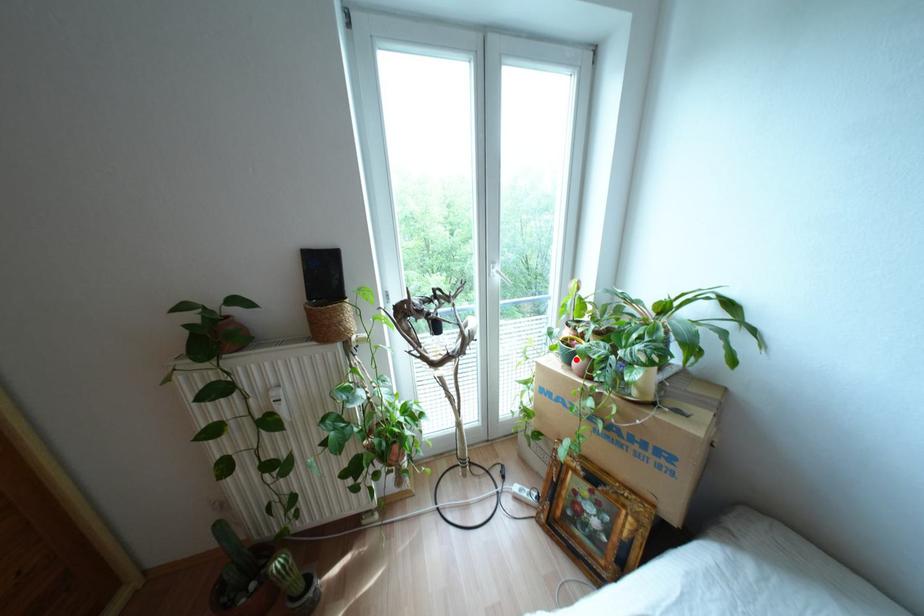
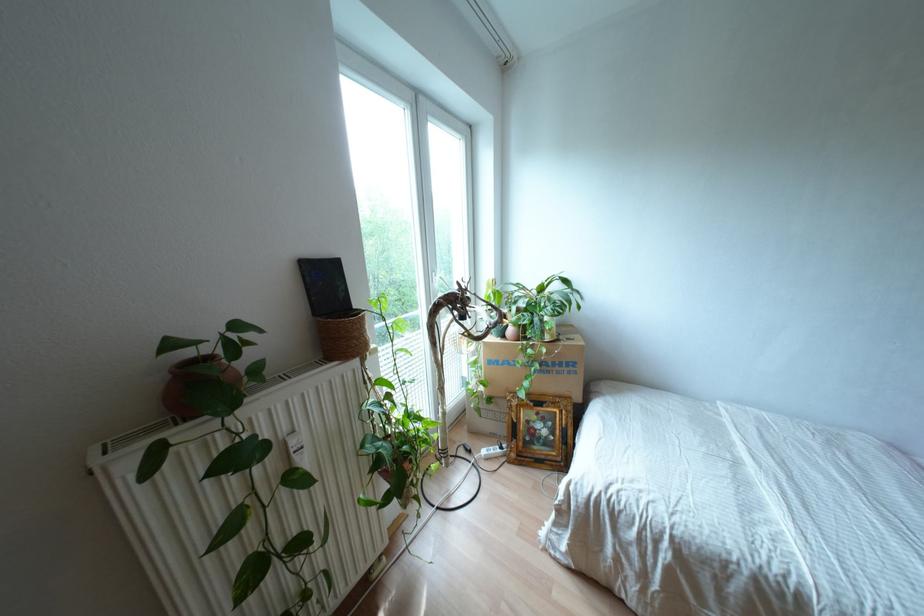
Question: I am providing you with two images of the same scene from different viewpoints. A red point is shown in image1. For the corresponding object point in image2, is it positioned nearer or farther from the camera?

Choices:
 (A) Nearer
 (B) Farther

Answer: (B)